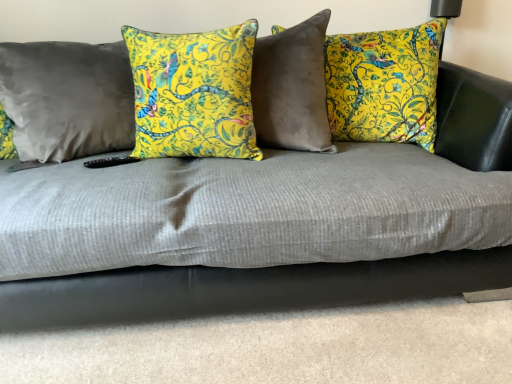
Question: Is satin gray pillow at left, the third pillow in the right-to-left sequence, behind yellow floral pillow at center, the second pillow viewed from the right?

Choices:
 (A) no
 (B) yes

Answer: (B)

Question: From the image's perspective, is satin gray pillow at left, placed as the 1th pillow when sorted from left to right, above yellow floral pillow at center, the second pillow viewed from the right?

Choices:
 (A) no
 (B) yes

Answer: (B)

Question: Would you say satin gray pillow at left, placed as the 1th pillow when sorted from left to right, contains yellow floral pillow at center, the second pillow positioned from the left?

Choices:
 (A) yes
 (B) no

Answer: (B)

Question: Is yellow floral pillow at center, the second pillow positioned from the left, at the back of satin gray pillow at left, placed as the 1th pillow when sorted from left to right?

Choices:
 (A) yes
 (B) no

Answer: (B)

Question: Is satin gray pillow at left, the third pillow in the right-to-left sequence, at the right side of yellow floral pillow at center, the second pillow viewed from the right?

Choices:
 (A) no
 (B) yes

Answer: (A)

Question: Does satin gray pillow at left, placed as the 1th pillow when sorted from left to right, appear on the left side of yellow floral pillow at center, the second pillow viewed from the right?

Choices:
 (A) no
 (B) yes

Answer: (B)

Question: Is yellow floral pillow at center, the second pillow positioned from the left, at the left side of satin gray pillow at left, placed as the 1th pillow when sorted from left to right?

Choices:
 (A) yes
 (B) no

Answer: (B)

Question: Is satin gray pillow at left, the third pillow in the right-to-left sequence, at the back of yellow floral pillow at center, the second pillow positioned from the left?

Choices:
 (A) yes
 (B) no

Answer: (B)

Question: Does yellow floral pillow at center, the second pillow viewed from the right, have a lesser height compared to satin gray pillow at left, the third pillow in the right-to-left sequence?

Choices:
 (A) no
 (B) yes

Answer: (B)

Question: Can you confirm if yellow floral pillow at center, the second pillow viewed from the right, is positioned to the right of satin gray pillow at left, the third pillow in the right-to-left sequence?

Choices:
 (A) yes
 (B) no

Answer: (A)

Question: Considering the relative sizes of yellow floral pillow at center, the second pillow positioned from the left, and satin gray pillow at left, placed as the 1th pillow when sorted from left to right, in the image provided, is yellow floral pillow at center, the second pillow positioned from the left, bigger than satin gray pillow at left, placed as the 1th pillow when sorted from left to right,?

Choices:
 (A) yes
 (B) no

Answer: (B)

Question: Considering the relative sizes of yellow floral pillow at center, the second pillow positioned from the left, and satin gray pillow at left, the third pillow in the right-to-left sequence, in the image provided, is yellow floral pillow at center, the second pillow positioned from the left, thinner than satin gray pillow at left, the third pillow in the right-to-left sequence,?

Choices:
 (A) no
 (B) yes

Answer: (B)

Question: Is satin gray pillow at left, the third pillow in the right-to-left sequence, positioned with its back to yellow floral pillow at center, the first pillow in the right-to-left sequence?

Choices:
 (A) yes
 (B) no

Answer: (B)